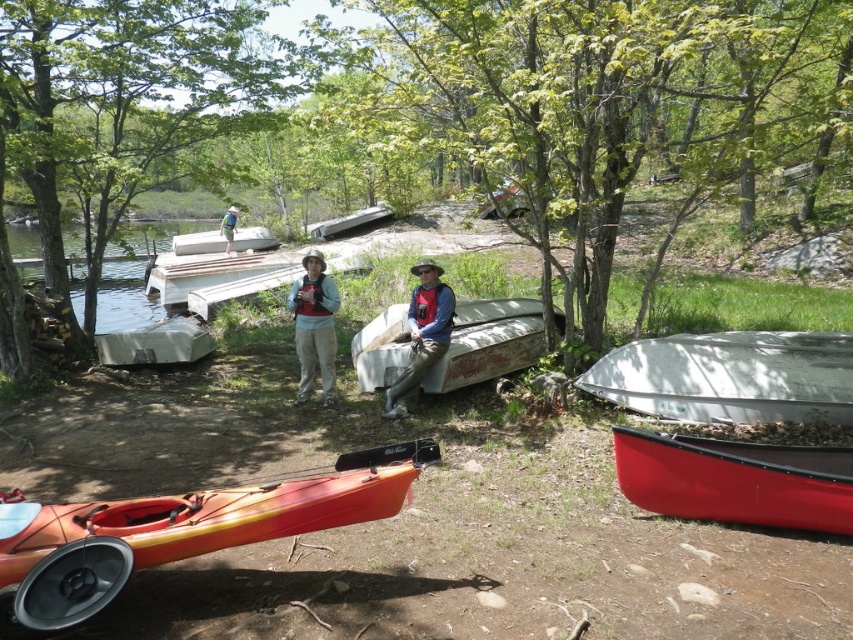
Is green leafy tree at center to the left of matte white kayak at center from the viewer's perspective?

No, green leafy tree at center is not to the left of matte white kayak at center.

Who is more distant from viewer, (380, 112) or (410, 369)?

The point (380, 112) is more distant.

Where is `green leafy tree at center`? The width and height of the screenshot is (853, 640). green leafy tree at center is located at coordinates (590, 104).

Which is more to the left, green leafy tree at upper left or red matte canoe at lower right?

From the viewer's perspective, green leafy tree at upper left appears more on the left side.

Image resolution: width=853 pixels, height=640 pixels. What do you see at coordinates (131, 99) in the screenshot?
I see `green leafy tree at upper left` at bounding box center [131, 99].

You are a GUI agent. You are given a task and a screenshot of the screen. Output one action in this format:
    pyautogui.click(x=<x>, y=<y>)
    Task: Click on the green leafy tree at upper left
    This screenshot has width=853, height=640.
    Given the screenshot: What is the action you would take?
    pyautogui.click(x=131, y=99)

Does green leafy tree at upper left appear under matte white kayak at center?

No, green leafy tree at upper left is not below matte white kayak at center.

Who is more forward, (39,228) or (398,390)?

Point (398,390)

Image resolution: width=853 pixels, height=640 pixels. I want to click on green leafy tree at upper left, so click(131, 99).